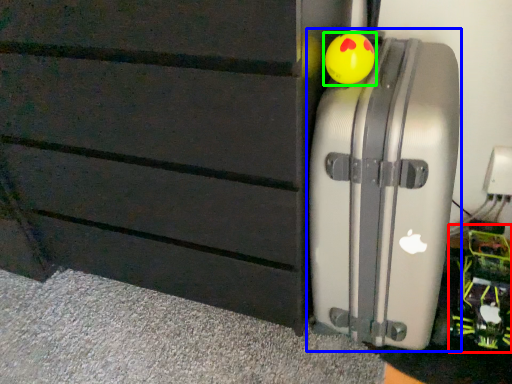
Question: Which object is the farthest from toy (highlighted by a red box)? Choose among these: suitcase (highlighted by a blue box) or toy (highlighted by a green box).

Choices:
 (A) suitcase
 (B) toy

Answer: (B)